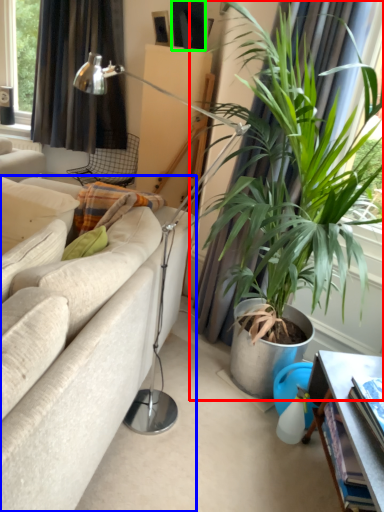
Question: Estimate the real-world distances between objects in this image. Which object is closer to houseplant (highlighted by a red box), studio couch (highlighted by a blue box) or picture frame (highlighted by a green box)?

Choices:
 (A) studio couch
 (B) picture frame

Answer: (A)